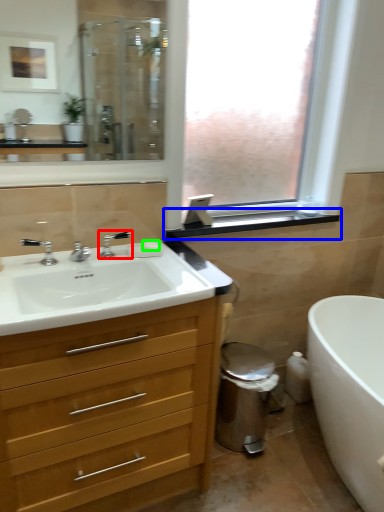
Question: Estimate the real-world distances between objects in this image. Which object is farther from tap (highlighted by a red box), window sill (highlighted by a blue box) or soap (highlighted by a green box)?

Choices:
 (A) window sill
 (B) soap

Answer: (A)